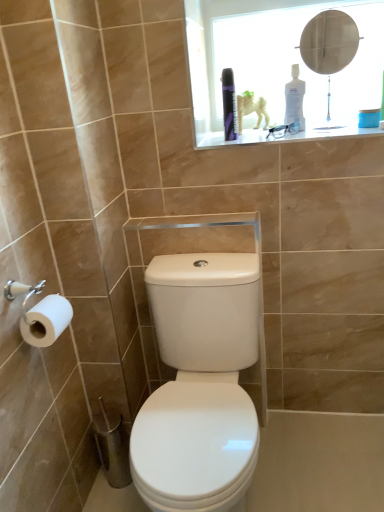
Find the location of a particular element. vacant space behind metallic round mirror at upper center is located at coordinates (316, 121).